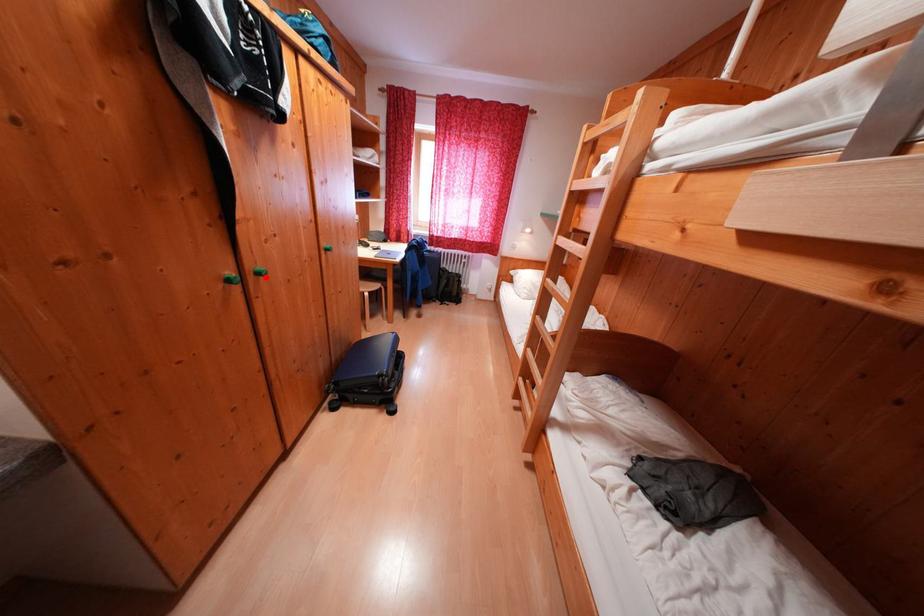
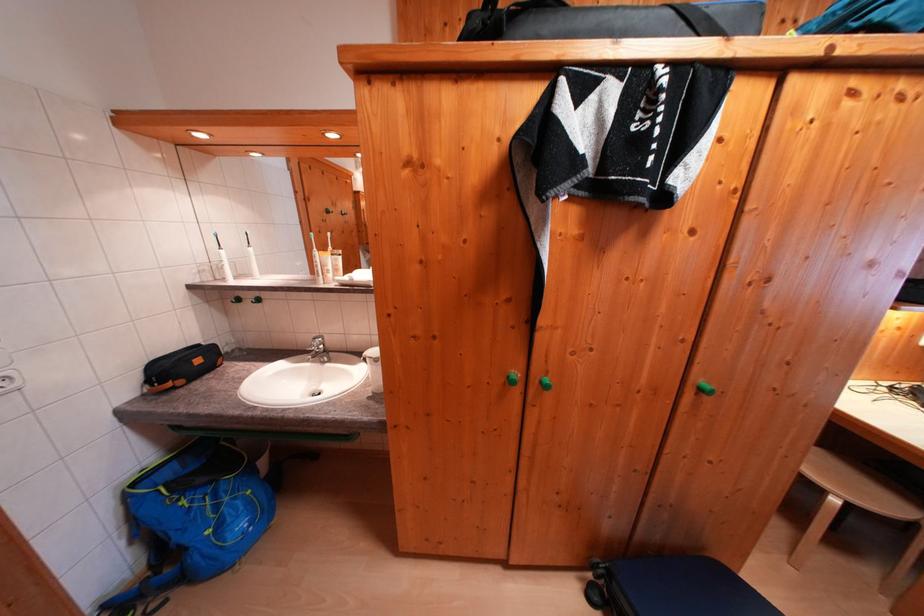
Find the pixel in the second image that matches the highlighted location in the first image.

(550, 387)